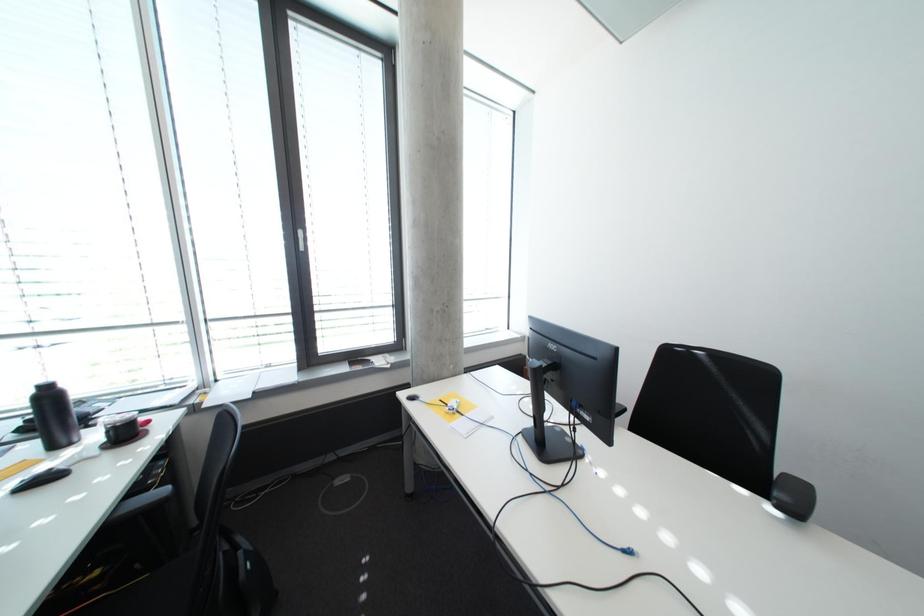
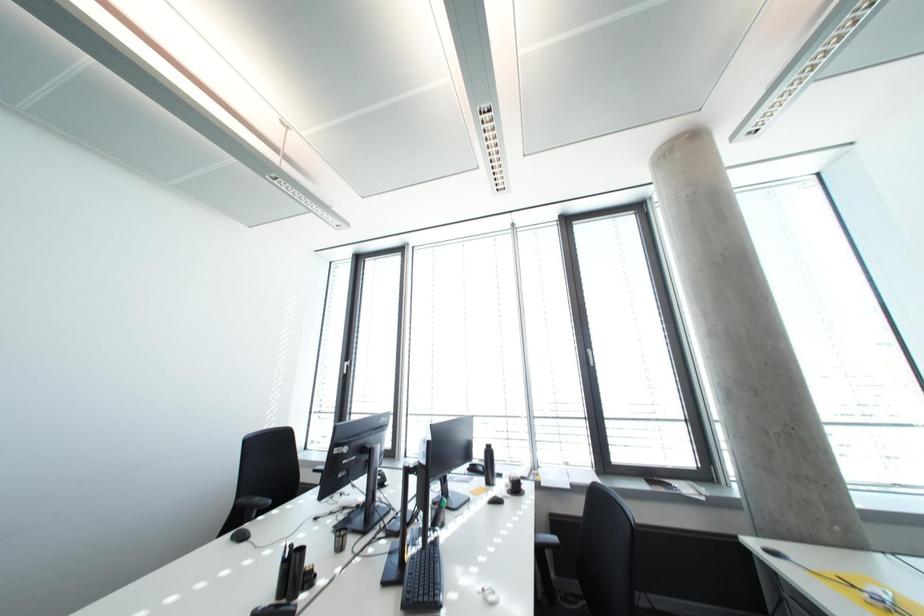
The first image is from the beginning of the video and the second image is from the end. How did the camera likely rotate when shooting the video?

The rotation direction of the camera is left-up.